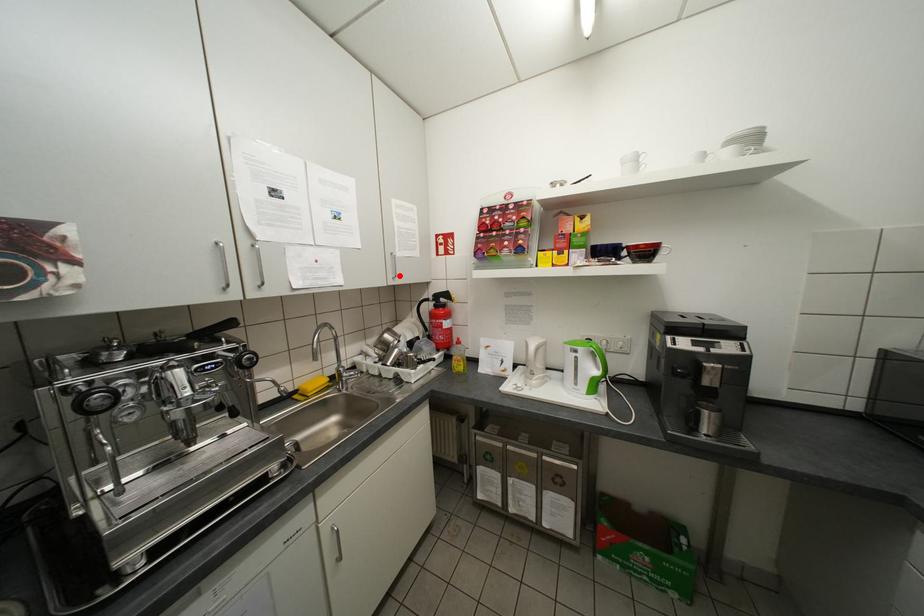
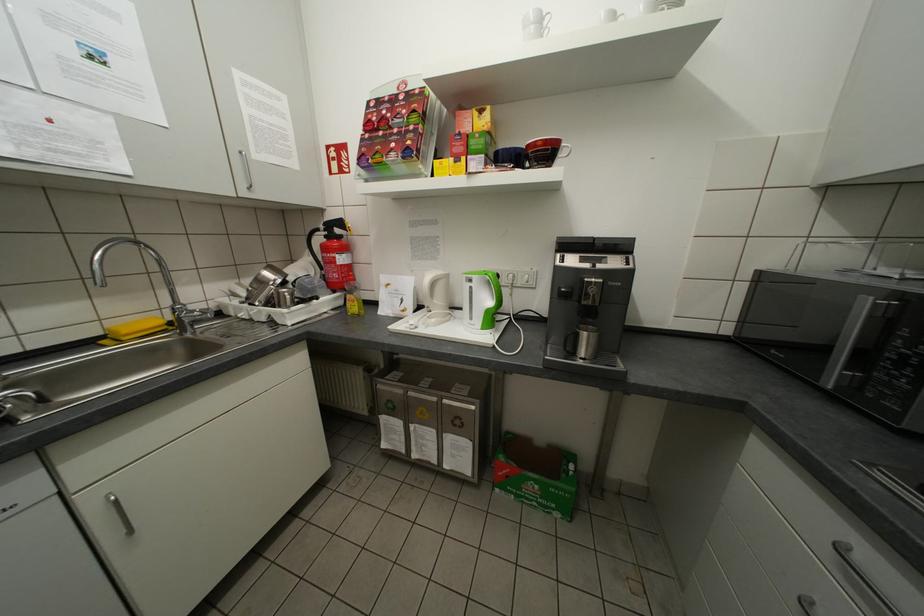
Where in the second image is the point corresponding to the highlighted location from the first image?

(251, 185)